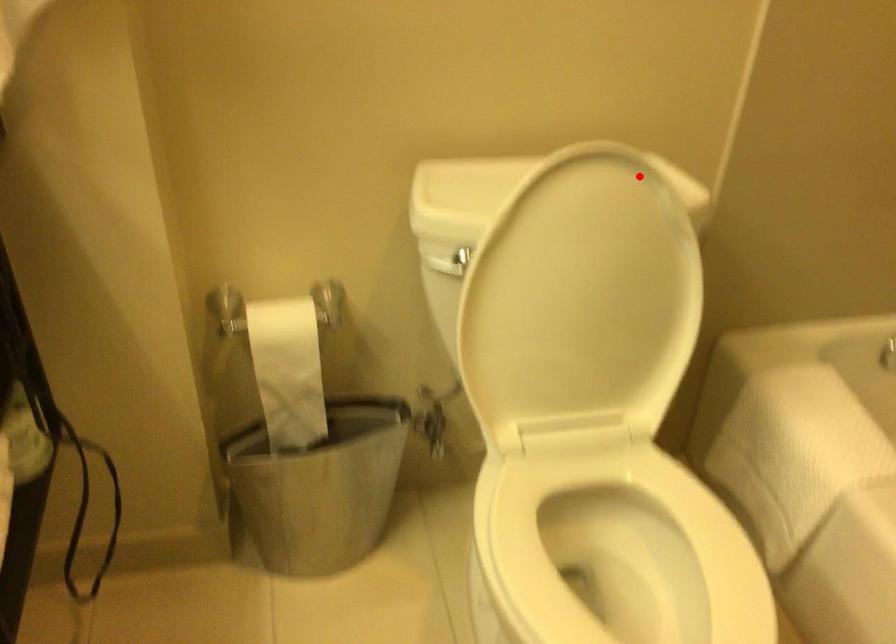
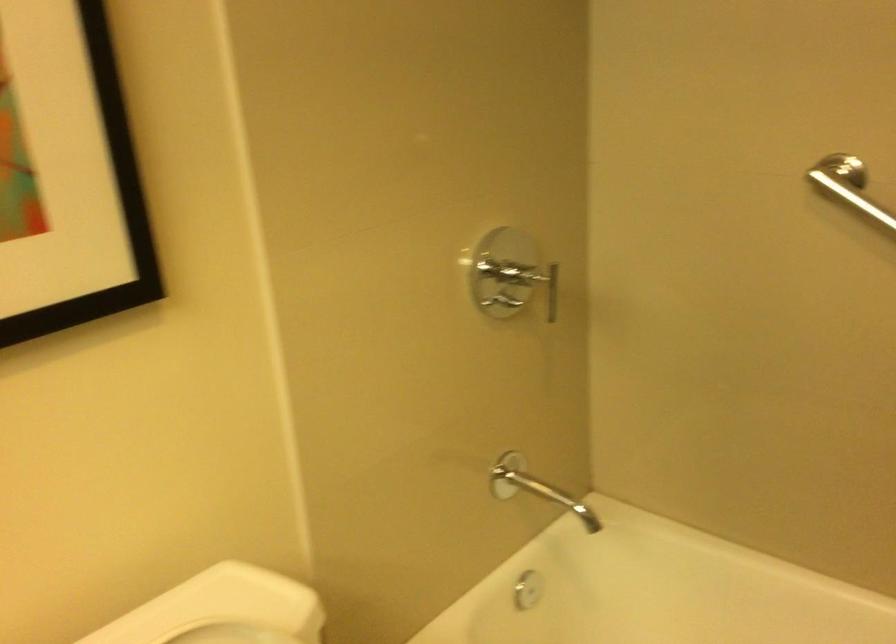
Question: I am providing you with two images of the same scene from different viewpoints. A red point is shown in image1. For the corresponding object point in image2, is it positioned nearer or farther from the camera?

Choices:
 (A) Nearer
 (B) Farther

Answer: (A)